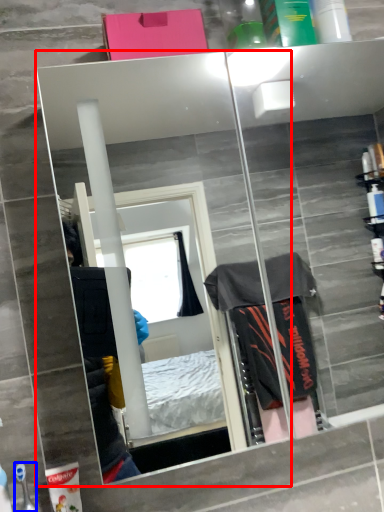
Question: Which object appears farthest to the camera in this image, mirror (highlighted by a red box) or toiletry (highlighted by a blue box)?

Choices:
 (A) mirror
 (B) toiletry

Answer: (B)